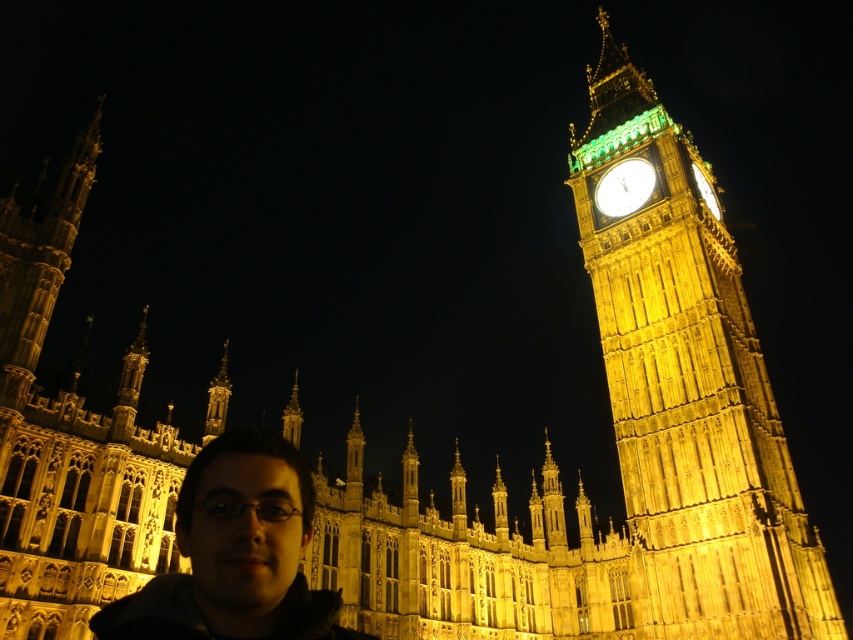
Question: Which point is farther to the camera?

Choices:
 (A) (648, 172)
 (B) (143, 620)

Answer: (A)

Question: Considering the real-world distances, which object is closest to the matte black jacket at lower left?

Choices:
 (A) gold metallic clock at upper right
 (B) golden stone clock tower at right

Answer: (B)

Question: Is matte black jacket at lower left further to camera compared to gold metallic clock at upper right?

Choices:
 (A) no
 (B) yes

Answer: (A)

Question: From the image, what is the correct spatial relationship of golden stone clock tower at right in relation to gold metallic clock at upper right?

Choices:
 (A) below
 (B) above

Answer: (B)

Question: Considering the relative positions of matte black jacket at lower left and gold metallic clock at upper right in the image provided, where is matte black jacket at lower left located with respect to gold metallic clock at upper right?

Choices:
 (A) left
 (B) right

Answer: (A)

Question: Which object is farther from the camera taking this photo?

Choices:
 (A) matte black jacket at lower left
 (B) golden stone clock tower at right
 (C) gold metallic clock at upper right

Answer: (C)